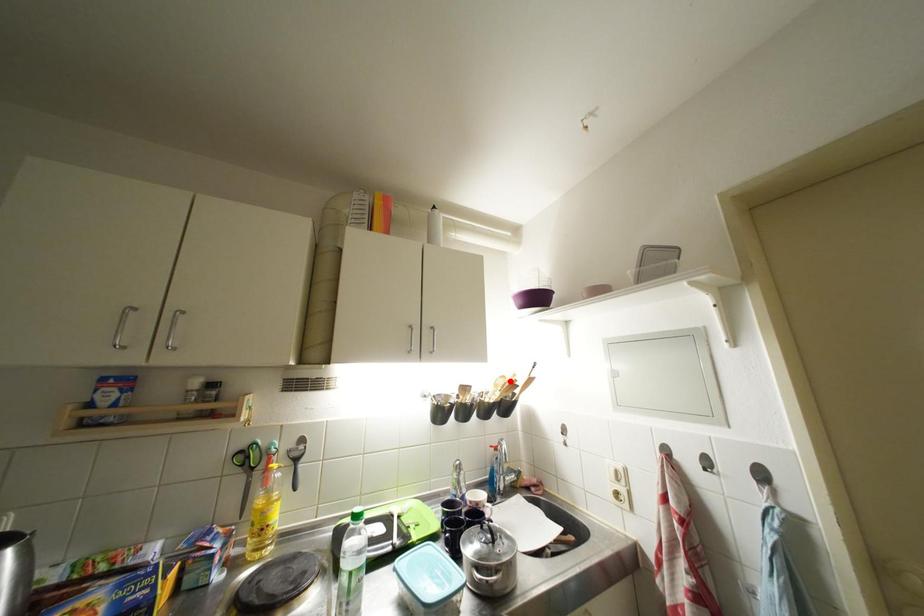
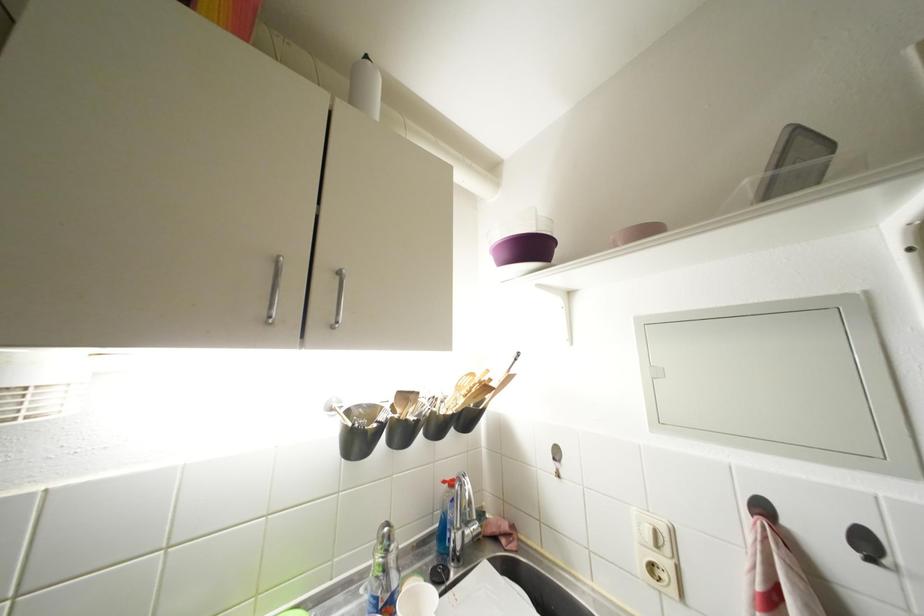
Locate, in the second image, the point that corresponds to the highlighted location in the first image.

(479, 379)